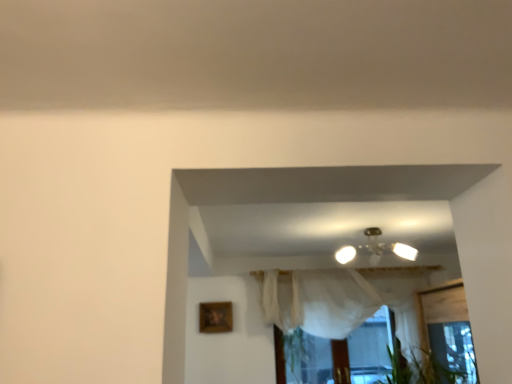
Question: Is wooden picture frame at lower left at the left side of white sheer curtain at center?

Choices:
 (A) yes
 (B) no

Answer: (A)

Question: Is wooden picture frame at lower left thinner than white sheer curtain at center?

Choices:
 (A) no
 (B) yes

Answer: (B)

Question: Considering the relative positions of wooden picture frame at lower left and white sheer curtain at center in the image provided, is wooden picture frame at lower left behind white sheer curtain at center?

Choices:
 (A) yes
 (B) no

Answer: (A)

Question: Could you tell me if wooden picture frame at lower left is facing white sheer curtain at center?

Choices:
 (A) no
 (B) yes

Answer: (A)

Question: From the image's perspective, is wooden picture frame at lower left beneath white sheer curtain at center?

Choices:
 (A) no
 (B) yes

Answer: (A)

Question: Can you see wooden picture frame at lower left touching white sheer curtain at center?

Choices:
 (A) no
 (B) yes

Answer: (A)

Question: Does white sheer curtain at center have a lesser height compared to metallic glass chandelier at center?

Choices:
 (A) yes
 (B) no

Answer: (B)

Question: Does white sheer curtain at center have a smaller size compared to metallic glass chandelier at center?

Choices:
 (A) no
 (B) yes

Answer: (A)

Question: From the image's perspective, is white sheer curtain at center on top of metallic glass chandelier at center?

Choices:
 (A) yes
 (B) no

Answer: (B)

Question: Is white sheer curtain at center wider than metallic glass chandelier at center?

Choices:
 (A) no
 (B) yes

Answer: (A)

Question: Does white sheer curtain at center lie in front of metallic glass chandelier at center?

Choices:
 (A) yes
 (B) no

Answer: (B)

Question: Is white sheer curtain at center facing away from metallic glass chandelier at center?

Choices:
 (A) no
 (B) yes

Answer: (A)

Question: Considering the relative sizes of wooden picture frame at lower left and metallic glass chandelier at center in the image provided, is wooden picture frame at lower left wider than metallic glass chandelier at center?

Choices:
 (A) no
 (B) yes

Answer: (A)